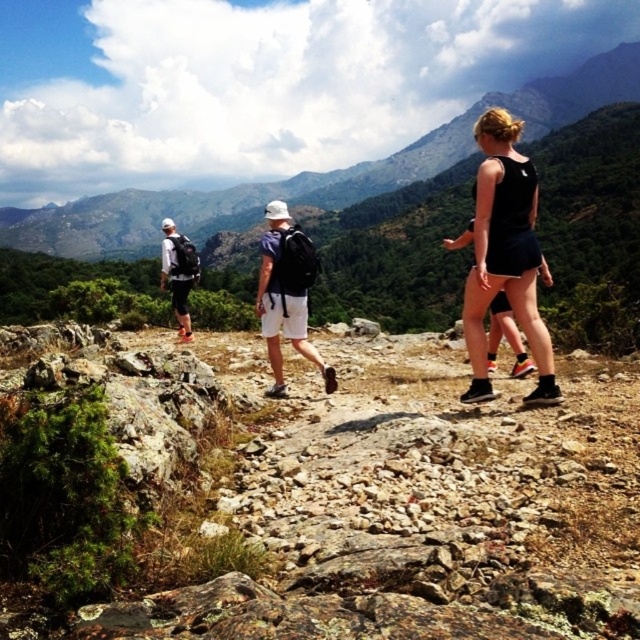
Question: Estimate the real-world distances between objects in this image. Which object is farther from the white matte backpack at center?

Choices:
 (A) matte black backpack at left
 (B) matte black shorts at center
 (C) black matte tank top at center

Answer: (A)

Question: Which of the following is the farthest from the observer?

Choices:
 (A) green grassy mountain at upper center
 (B) black matte tank top at center
 (C) matte black shorts at center

Answer: (A)

Question: Is green grassy mountain at upper center in front of white matte backpack at center?

Choices:
 (A) no
 (B) yes

Answer: (A)

Question: Is matte black shorts at center thinner than black matte tank top at center?

Choices:
 (A) yes
 (B) no

Answer: (B)

Question: Can you confirm if black matte tank top at center is positioned below matte black backpack at left?

Choices:
 (A) no
 (B) yes

Answer: (B)

Question: Which point is farther to the camera?

Choices:
 (A) (508, 244)
 (B) (305, 262)
 (C) (172, 284)
 (D) (534, 220)

Answer: (C)